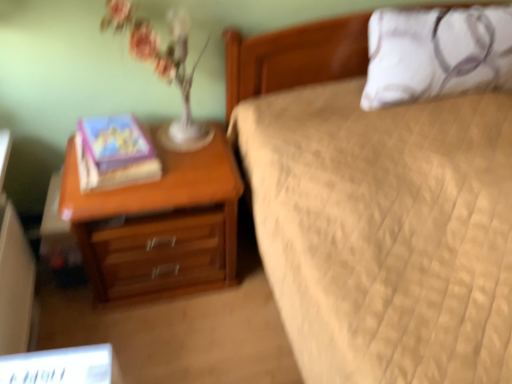
Find the location of a particular element. free space in front of matte purple book at left is located at coordinates (114, 196).